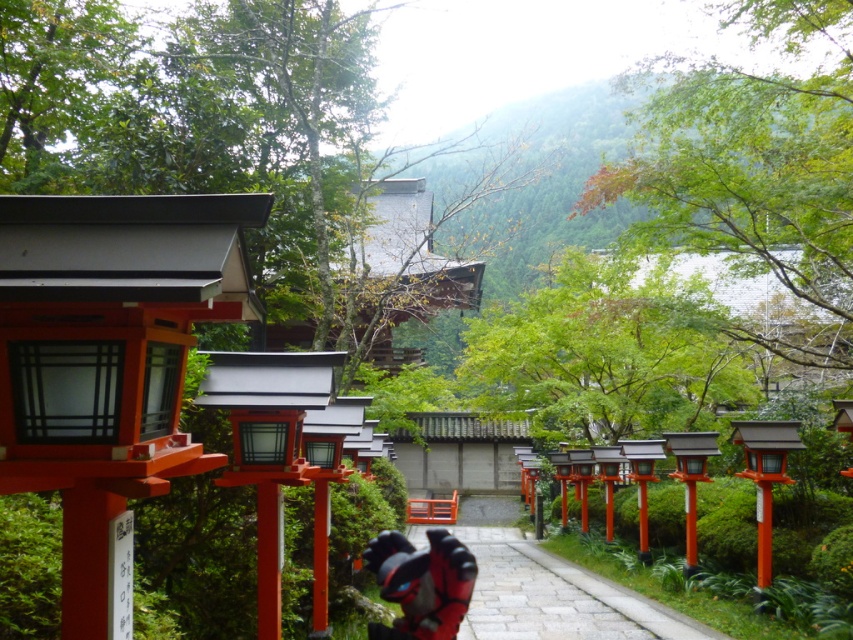
Who is positioned more to the right, smooth stone path at center or shiny red helmet at center?

From the viewer's perspective, smooth stone path at center appears more on the right side.

Is point (543, 602) in front of point (445, 589)?

No, (543, 602) is further to viewer.

This screenshot has width=853, height=640. What are the coordinates of `smooth stone path at center` in the screenshot? It's located at (556, 596).